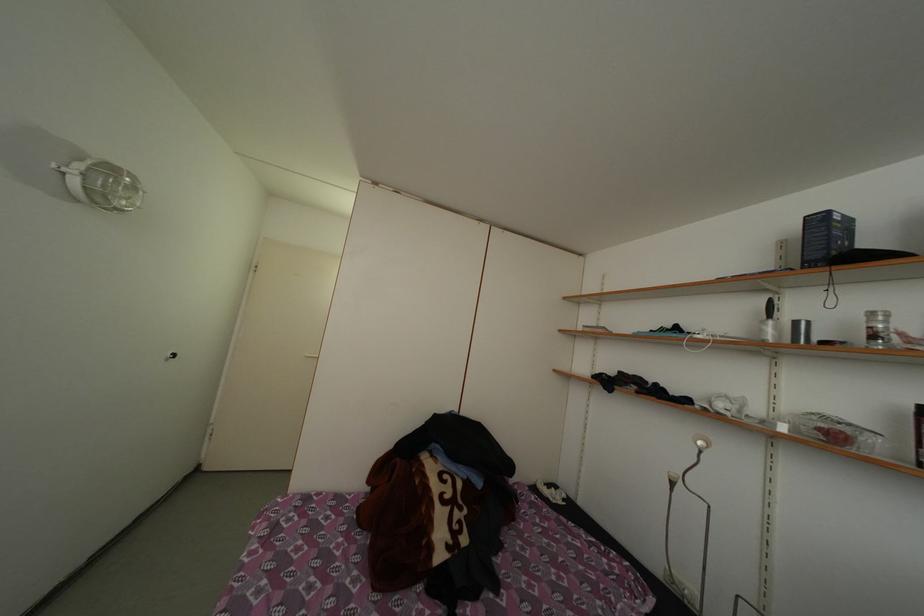
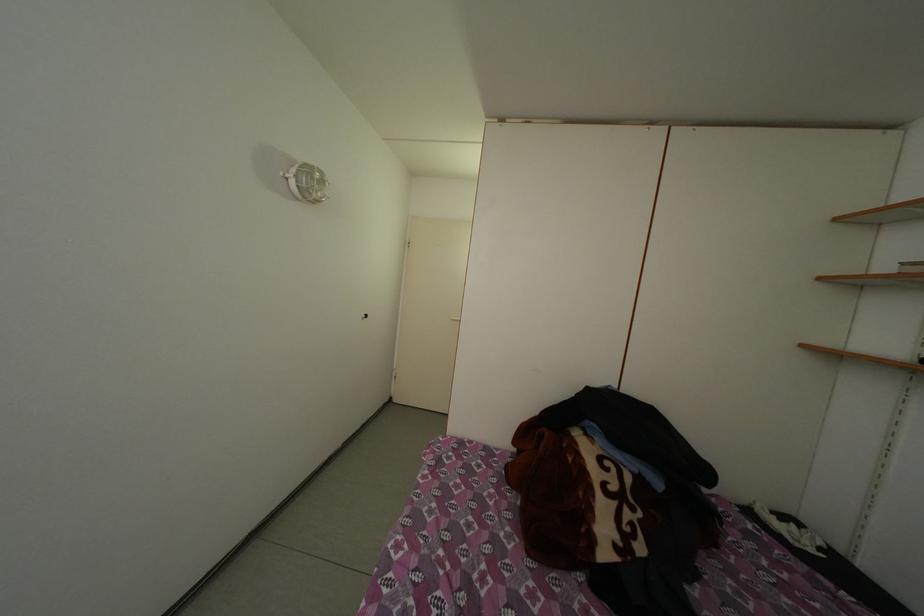
Question: The first image is from the beginning of the video and the second image is from the end. How did the camera likely rotate when shooting the video?

Choices:
 (A) Left
 (B) Right
 (C) Up
 (D) Down

Answer: (A)